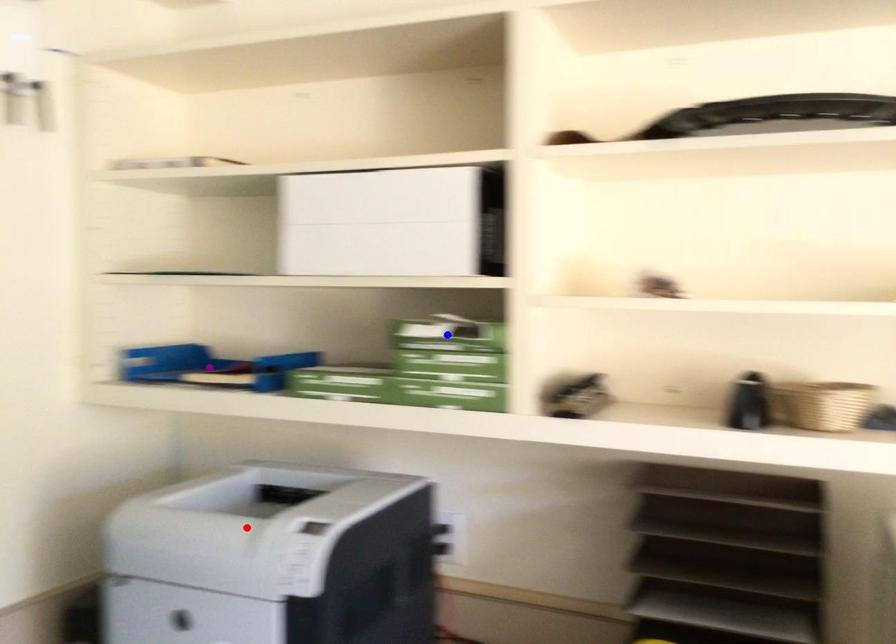
Order these from nearest to farthest:
- purple point
- red point
- blue point

red point
blue point
purple point